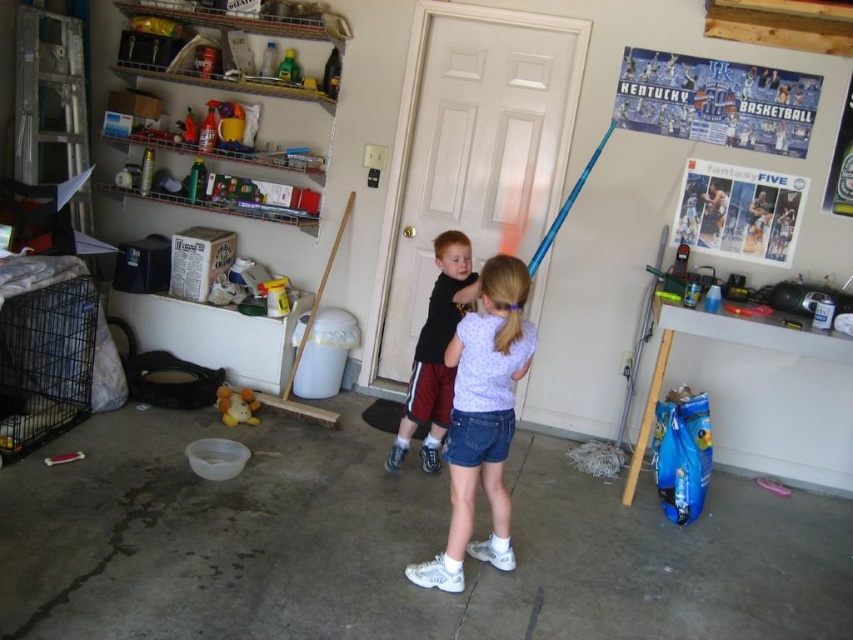
Which is above, denim shorts at center or white plush toy at center?

denim shorts at center is higher up.

Which is behind, point (471, 419) or point (218, 410)?

The point (218, 410) is more distant.

This screenshot has width=853, height=640. Find the location of `denim shorts at center`. denim shorts at center is located at coordinates (482, 420).

Between black matte shirt at center and white plush toy at center, which one is positioned higher?

black matte shirt at center is higher up.

Who is more distant from viewer, (466, 250) or (247, 388)?

The point (247, 388) is behind.

The height and width of the screenshot is (640, 853). In order to click on black matte shirt at center in this screenshot , I will do `click(436, 353)`.

Between denim shorts at center and black matte shirt at center, which one is positioned higher?

black matte shirt at center is above.

Is point (485, 413) positioned after point (421, 372)?

No, it is not.

Identify the location of denim shorts at center. Image resolution: width=853 pixels, height=640 pixels. (482, 420).